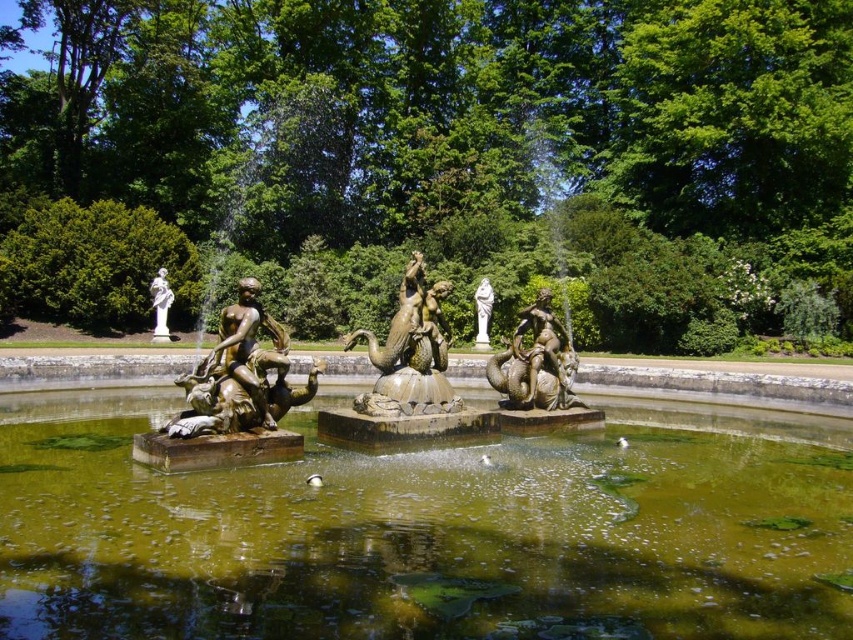
Is green mossy water at center taller than white marble statue at upper left?

Incorrect, green mossy water at center's height is not larger of white marble statue at upper left's.

Is green mossy water at center below white marble statue at upper left?

Yes.

Is point (231, 621) behind point (167, 284)?

No, (231, 621) is in front of (167, 284).

This screenshot has height=640, width=853. Find the location of `green mossy water at center`. green mossy water at center is located at coordinates (428, 531).

How far apart are gold polished statue at center and white marble statue at upper left?

40.70 meters

From the picture: Does gold polished statue at center appear over white marble statue at upper left?

No.

Is point (538, 404) closer to viewer compared to point (155, 282)?

Yes, it is in front of point (155, 282).

Locate an element on the screen. The height and width of the screenshot is (640, 853). gold polished statue at center is located at coordinates (537, 362).

Does gold-bronze mermaid at center appear on the left side of white marble statue at upper left?

In fact, gold-bronze mermaid at center is to the right of white marble statue at upper left.

Does gold-bronze mermaid at center appear on the right side of white marble statue at upper left?

Yes, gold-bronze mermaid at center is to the right of white marble statue at upper left.

Identify the location of gold-bronze mermaid at center. (409, 353).